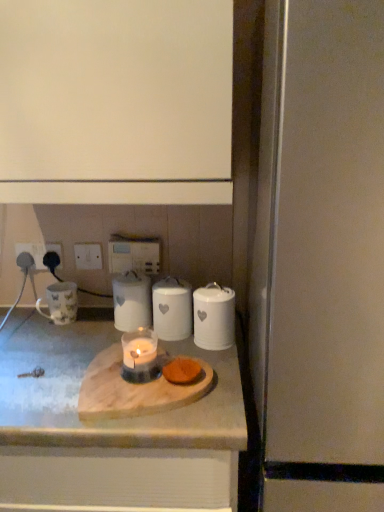
The width and height of the screenshot is (384, 512). What are the coordinates of `vacant area that lies in front of white ceramic candle at center, which is the 2th appliance in left-to-right order` in the screenshot? It's located at (98, 349).